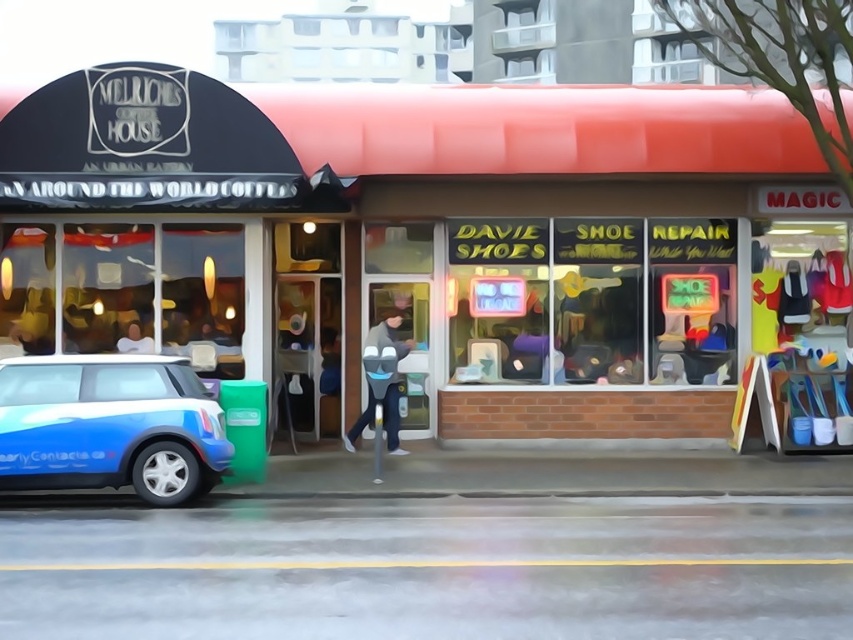
You are a delivery person with a package that requires a 3.5 meter wide space to maneuver your cart. You are standing in front of the brick storefront at center and need to reach the blue matte toy car at lower left. Is there enough space for your cart to move between them?

The distance between the brick storefront at center and the blue matte toy car at lower left is 4.40 meters, which is wider than the required 3.5 meters. Therefore, there is enough space for the cart to maneuver between them.

You are a delivery person who needs to place a small package on the blue matte toy car at lower left and the smooth skin face at upper center. Which object can accommodate the package if it requires more space?

The blue matte toy car at lower left can accommodate the package since its width is larger than the smooth skin face at upper center.

You are a delivery person who needs to place a blue matte toy car at lower left exactly at coordinate point 0.666, 0.129. The delivery area is a 1x1 grid where the bottom left corner is 0,0 and the top right is 1,1. Can you confirm the exact location to place it?

The blue matte toy car at lower left should be placed at coordinate point [109,426], which is 66.666 centimeters from the left edge and 12.9 centimeters from the bottom edge in a 1x1 meter grid.